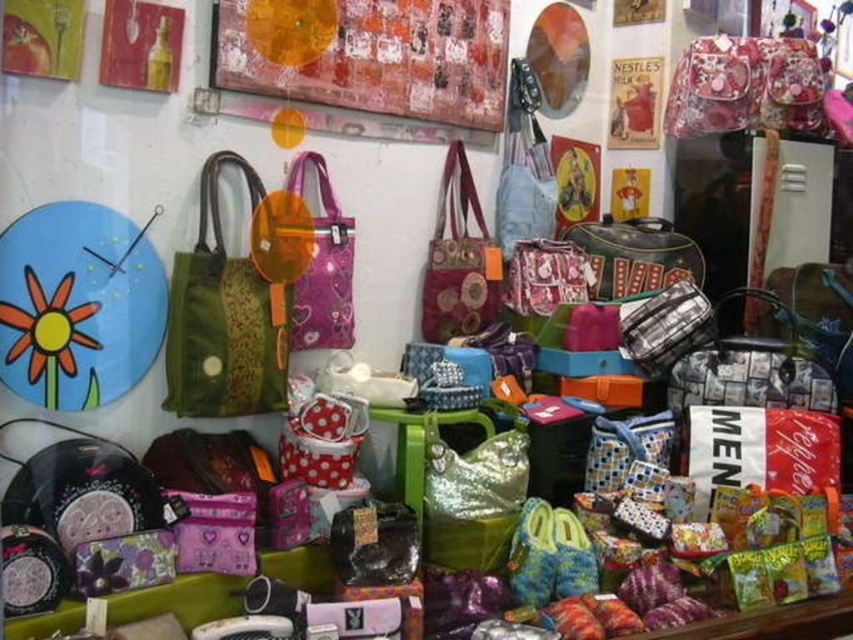
Is patterned fabric handbag at center wider than shiny metallic bag at center?

In fact, patterned fabric handbag at center might be narrower than shiny metallic bag at center.

In order to click on patterned fabric handbag at center in this screenshot , I will do `click(459, 259)`.

This screenshot has height=640, width=853. I want to click on patterned fabric handbag at center, so click(x=459, y=259).

Who is shorter, textured canvas painting at upper center or shiny gold handbag at center?

shiny gold handbag at center

Is textured canvas painting at upper center thinner than shiny gold handbag at center?

No, textured canvas painting at upper center is not thinner than shiny gold handbag at center.

Is point (392, 8) positioned after point (426, 497)?

Yes.

Find the location of a particular element. The image size is (853, 640). textured canvas painting at upper center is located at coordinates (383, 60).

Between textured canvas painting at upper center and patterned fabric handbag at center, which one appears on the right side from the viewer's perspective?

Positioned to the right is patterned fabric handbag at center.

Does point (444, 58) come in front of point (457, 202)?

Yes, point (444, 58) is closer to viewer.

Find the location of a particular element. textured canvas painting at upper center is located at coordinates (383, 60).

This screenshot has width=853, height=640. Identify the location of textured canvas painting at upper center. (383, 60).